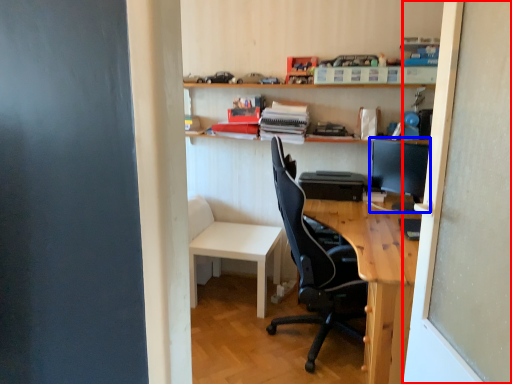
Question: Which object is further to the camera taking this photo, screen door (highlighted by a red box) or computer monitor (highlighted by a blue box)?

Choices:
 (A) screen door
 (B) computer monitor

Answer: (B)